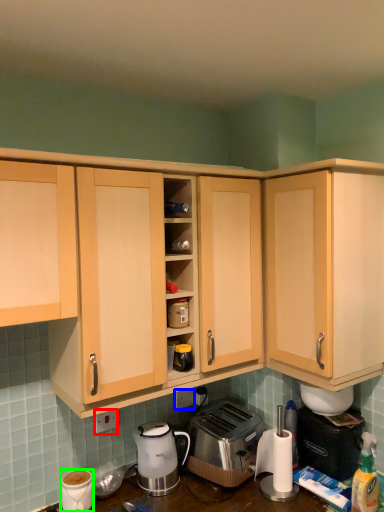
Question: Which object is positioned closest to electric outlet (highlighted by a red box)? Select from electric outlet (highlighted by a blue box) and coffee cup (highlighted by a green box).

Choices:
 (A) electric outlet
 (B) coffee cup

Answer: (B)